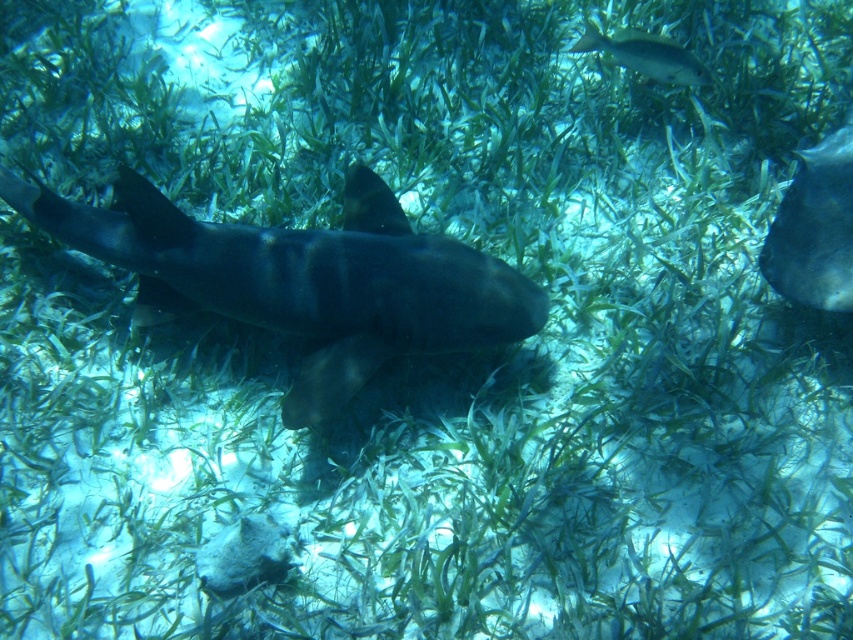
Between point (173, 275) and point (685, 54), which one is positioned behind?

Positioned behind is point (685, 54).

Can you confirm if dark gray matte shark at center is smaller than shiny silver fish at upper right?

No.

I want to click on dark gray matte shark at center, so click(x=300, y=278).

At what (x,y) coordinates should I click in order to perform the action: click on dark gray matte shark at center. Please return your answer as a coordinate pair (x, y). The width and height of the screenshot is (853, 640). Looking at the image, I should click on (300, 278).

Is dark gray matte shark at center wider than smooth gray stingray at right?

Indeed, dark gray matte shark at center has a greater width compared to smooth gray stingray at right.

Does dark gray matte shark at center have a smaller size compared to smooth gray stingray at right?

No, dark gray matte shark at center is not smaller than smooth gray stingray at right.

Who is more forward, (115, 264) or (792, 285)?

Point (792, 285) is more forward.

The width and height of the screenshot is (853, 640). Identify the location of dark gray matte shark at center. (300, 278).

Can you confirm if smooth gray stingray at right is shorter than shiny silver fish at upper right?

No.

Does smooth gray stingray at right have a greater height compared to shiny silver fish at upper right?

Correct, smooth gray stingray at right is much taller as shiny silver fish at upper right.

Is point (805, 161) positioned after point (624, 54)?

No, (805, 161) is in front of (624, 54).

Identify the location of smooth gray stingray at right. This screenshot has height=640, width=853. (814, 228).